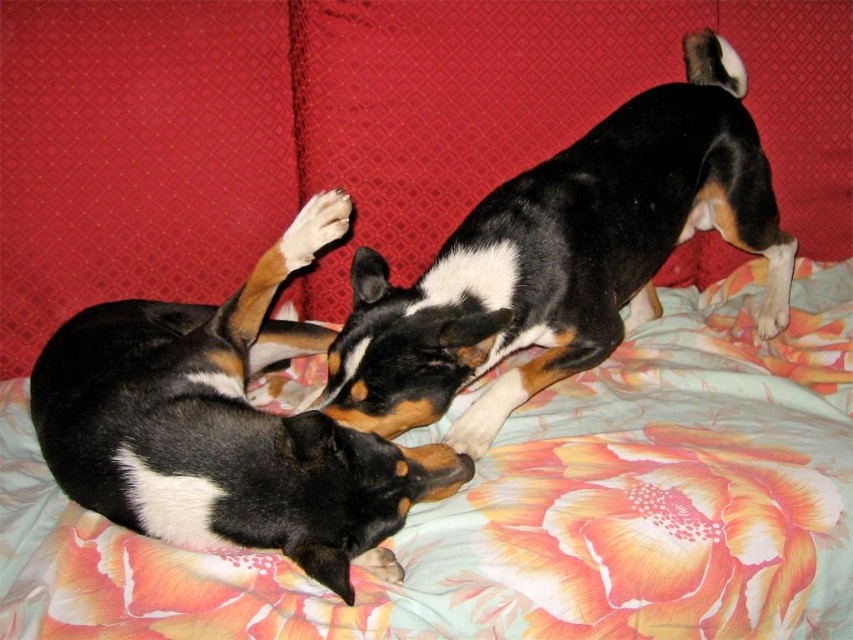
Question: Which point is closer to the camera?

Choices:
 (A) black and white fur at upper center
 (B) black and white fur at center
 (C) floral fabric bedspread at center
 (D) white soft paw at center

Answer: (C)

Question: Is floral fabric bedspread at center wider than black and white fur at center?

Choices:
 (A) yes
 (B) no

Answer: (A)

Question: Among these points, which one is nearest to the camera?

Choices:
 (A) (570, 237)
 (B) (450, 625)
 (C) (204, 372)
 (D) (316, 198)

Answer: (B)

Question: Can you confirm if black and white fur at upper center is positioned above black and white fur at center?

Choices:
 (A) yes
 (B) no

Answer: (A)

Question: Which of the following is the farthest from the observer?

Choices:
 (A) (784, 240)
 (B) (293, 616)
 (C) (315, 202)
 (D) (299, 508)

Answer: (A)

Question: Is black and white fur at upper center further to camera compared to black and white fur at center?

Choices:
 (A) yes
 (B) no

Answer: (A)